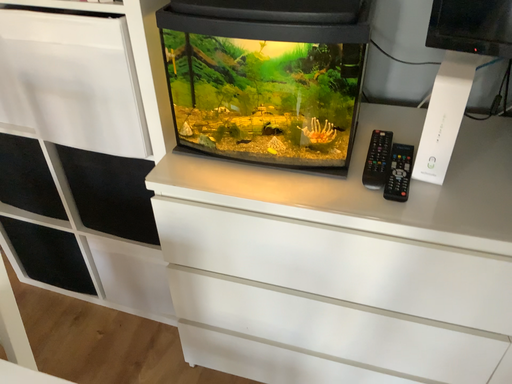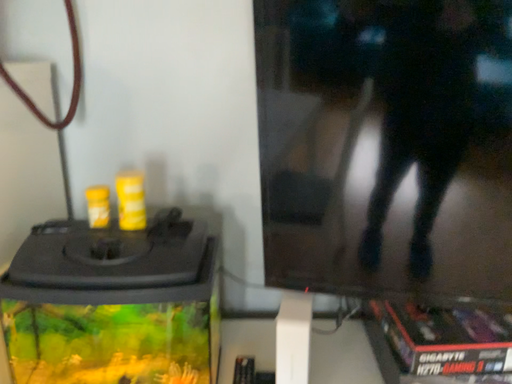
Question: How did the camera likely rotate when shooting the video?

Choices:
 (A) rotated left
 (B) rotated right

Answer: (B)